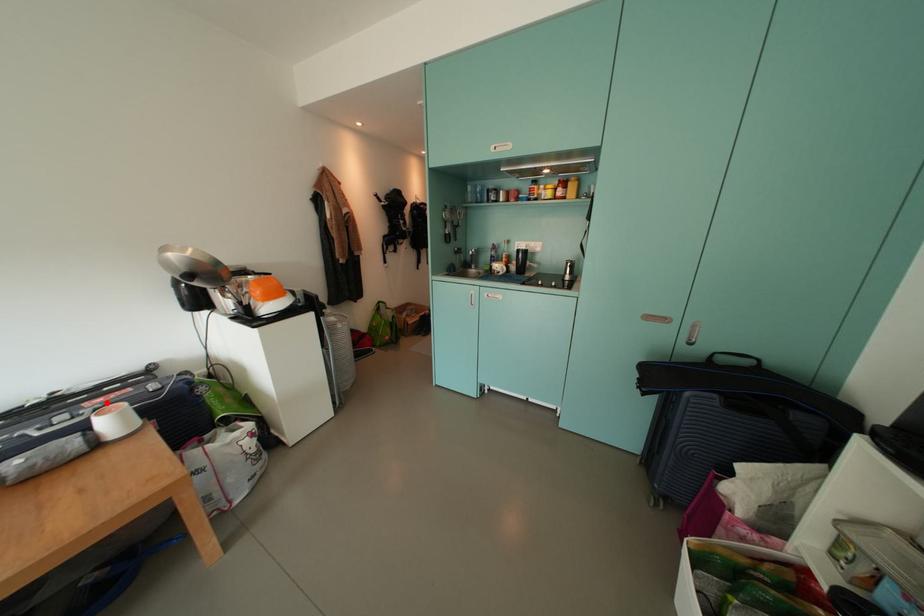
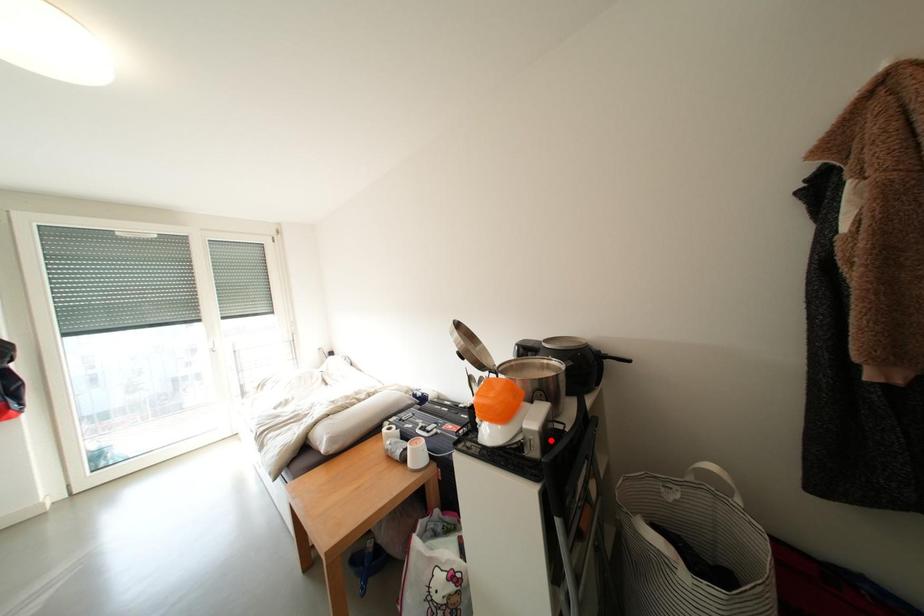
I am providing you with two images of the same scene from different viewpoints. A red point is marked on the first image and another point is marked on the second image. Do the highlighted points in image1 and image2 indicate the same real-world spot?

No